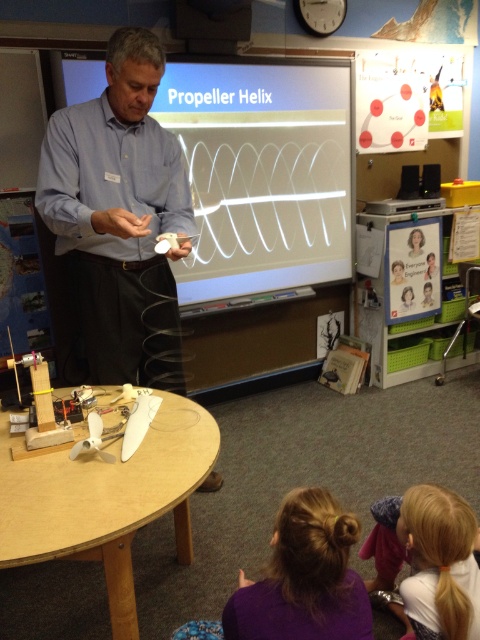
You are a student sitting in the classroom and you notice two blonde hair styles. The first is the blonde hair bun at lower center and the second is the blonde hair at lower right. Which one is smaller in size?

The blonde hair bun at lower center is smaller in size compared to the blonde hair at lower right.

You are standing in the classroom and want to locate the blonde hair bun at lower center. According to the coordinates provided, where exactly should you look?

The blonde hair bun at lower center is located at coordinates point [303,577].